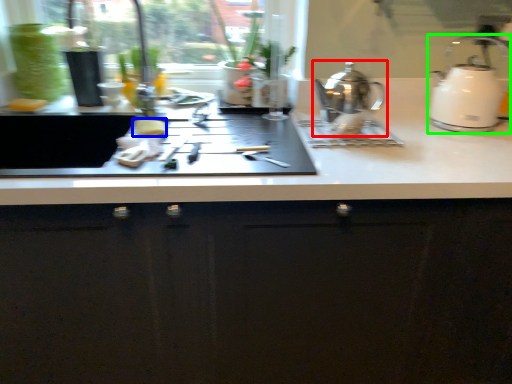
Question: Which object is the farthest from kettle (highlighted by a red box)? Choose among these: food (highlighted by a blue box) or kettle (highlighted by a green box).

Choices:
 (A) food
 (B) kettle

Answer: (A)